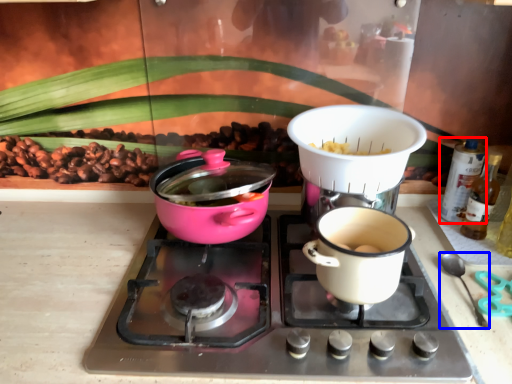
Question: Which point is further to the camera, bottle (highlighted by a red box) or silverware (highlighted by a blue box)?

Choices:
 (A) bottle
 (B) silverware

Answer: (A)